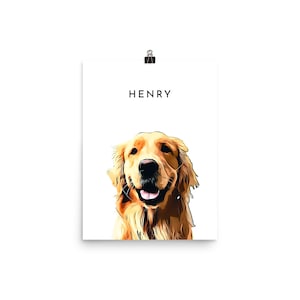
This screenshot has width=300, height=300. Identify the location of corners of picture. (82, 238), (214, 238), (81, 65), (216, 59).